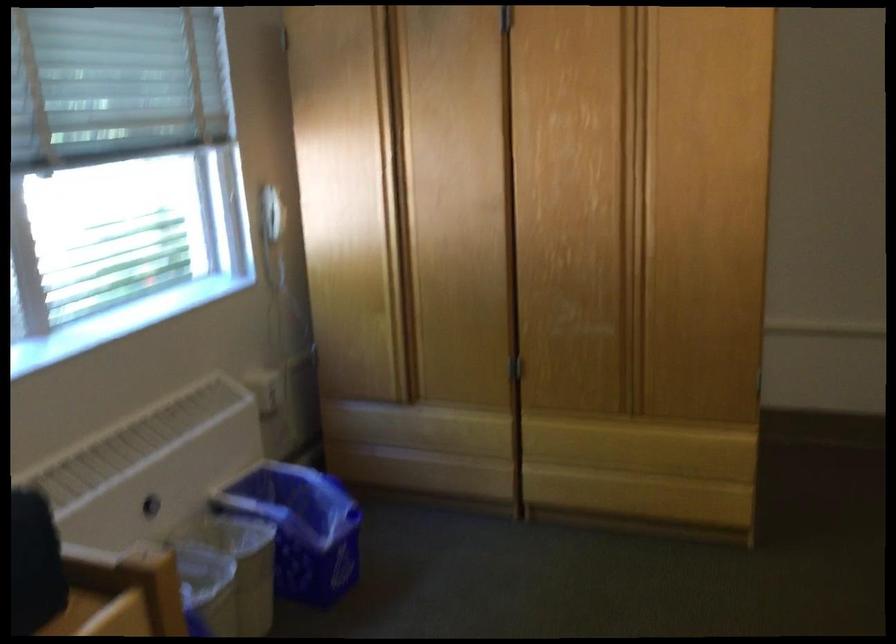
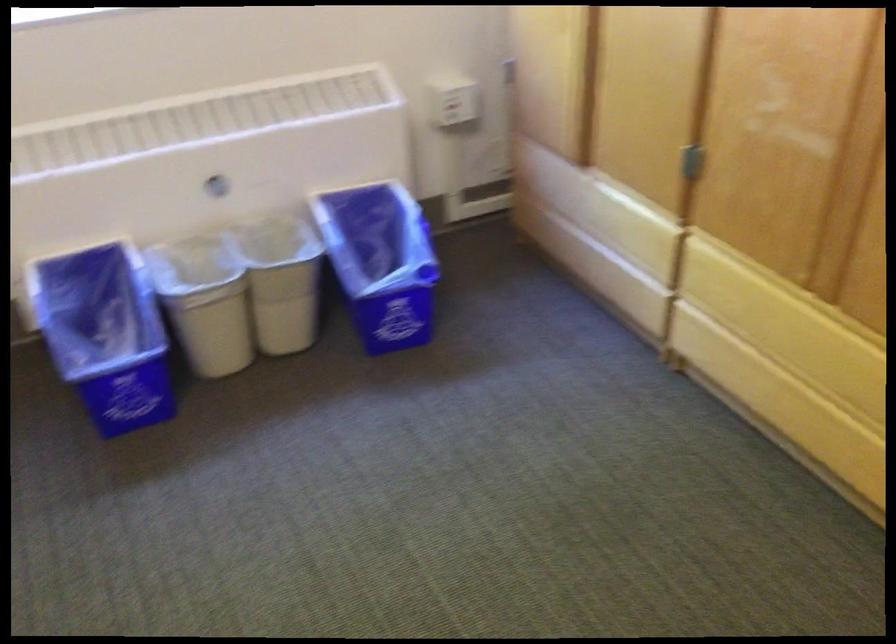
Locate, in the second image, the point that corresponds to the point at 254,567 in the first image.

(281, 281)